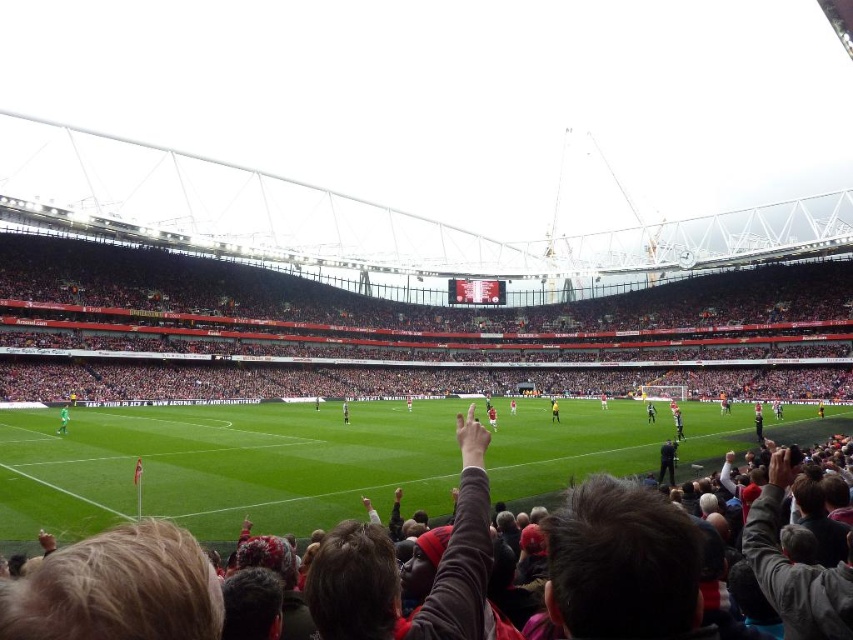
Is point (67, 422) positioned in front of point (553, 406)?

That is True.

This screenshot has width=853, height=640. Identify the location of green jersey at center. (62, 419).

Does green grass football field at center have a lesser width compared to yellow jersey at center?

Incorrect, green grass football field at center's width is not less than yellow jersey at center's.

Is green grass football field at center to the right of yellow jersey at center from the viewer's perspective?

No, green grass football field at center is not to the right of yellow jersey at center.

Is point (405, 433) farther from camera compared to point (552, 403)?

No, (405, 433) is in front of (552, 403).

The width and height of the screenshot is (853, 640). I want to click on green grass football field at center, so click(x=221, y=465).

Is point (294, 529) more distant than point (65, 410)?

That is False.

Is green grass football field at center above green jersey at center?

Actually, green grass football field at center is below green jersey at center.

The image size is (853, 640). Find the location of `green grass football field at center`. green grass football field at center is located at coordinates (221, 465).

The image size is (853, 640). What are the coordinates of `green grass football field at center` in the screenshot? It's located at (221, 465).